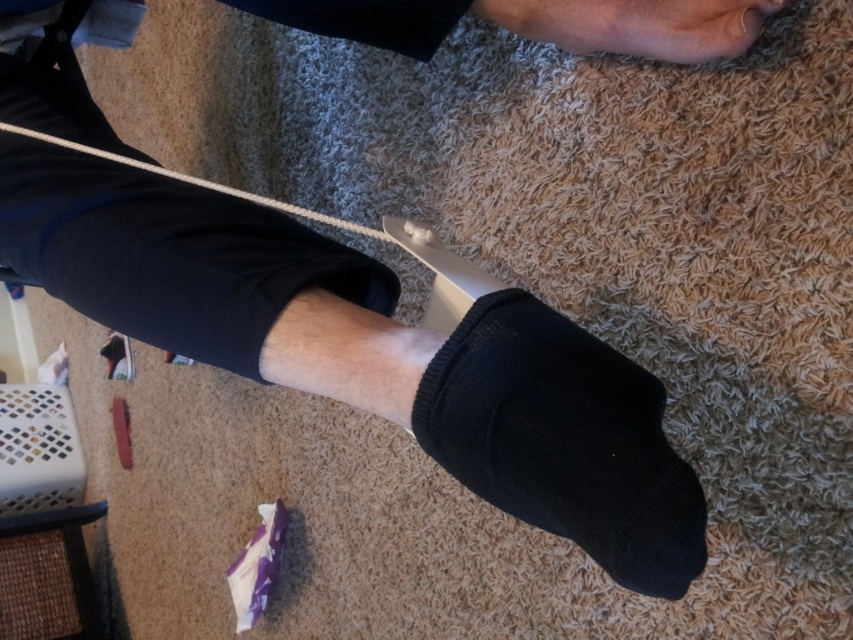
Can you confirm if matte black foot at upper right is positioned below white string at center?

Actually, matte black foot at upper right is above white string at center.

Does matte black foot at upper right come in front of white string at center?

Yes, matte black foot at upper right is in front of white string at center.

Between point (711, 20) and point (103, 150), which one is positioned behind?

Positioned behind is point (103, 150).

At what (x,y) coordinates should I click in order to perform the action: click on matte black foot at upper right. Please return your answer as a coordinate pair (x, y). Image resolution: width=853 pixels, height=640 pixels. Looking at the image, I should click on (675, 26).

Is point (479, 355) positioned behind point (161, 173)?

No, it is not.

Is black knitted sock at lower center wider than white string at center?

No.

This screenshot has height=640, width=853. What do you see at coordinates (563, 440) in the screenshot?
I see `black knitted sock at lower center` at bounding box center [563, 440].

Where is `black knitted sock at lower center`? The image size is (853, 640). black knitted sock at lower center is located at coordinates (563, 440).

Which is behind, point (462, 317) or point (764, 3)?

Positioned behind is point (764, 3).

This screenshot has height=640, width=853. What do you see at coordinates (563, 440) in the screenshot? I see `black knitted sock at lower center` at bounding box center [563, 440].

Between point (686, 566) and point (677, 12), which one is positioned in front?

Point (686, 566) is in front.

Locate an element on the screen. black knitted sock at lower center is located at coordinates coord(563,440).